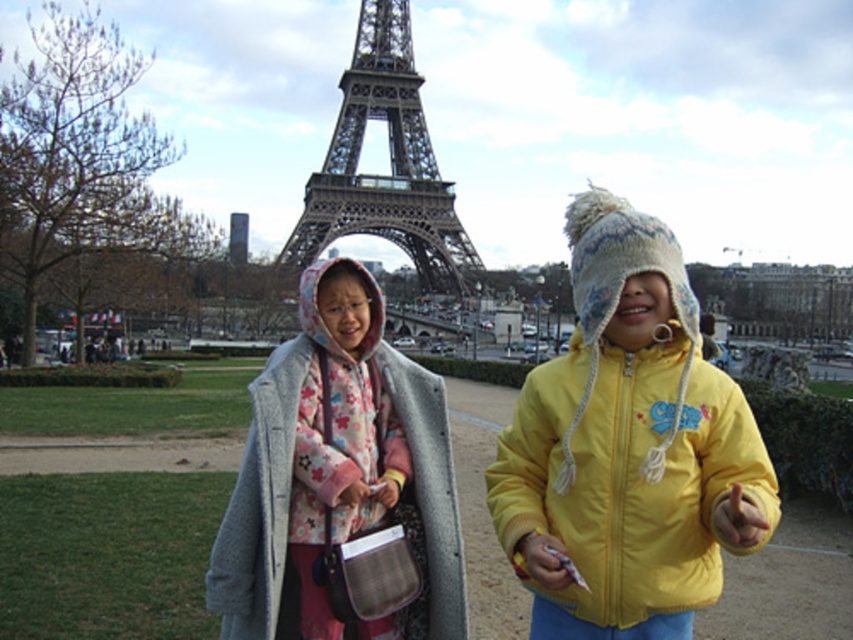
You are a photographer trying to capture the Eiffel Tower and the children in the frame. Based on the scene, can you determine if the yellow fleece jacket at center is blocking the view of the metallic structure at center?

The yellow fleece jacket at center is positioned under the metallic structure at center, so the jacket is below the structure and does not block its view.

In the scene shown: You are a photographer trying to capture a photo of the Eiffel Tower. There is a point at coordinates point (x=627, y=448) on the yellow fleece jacket at center. If you want to focus on the Eiffel Tower in the background, will this point be in focus?

The point (x=627, y=448) is on the yellow fleece jacket at center, which is in the foreground. Since the Eiffel Tower is in the background, focusing on the Eiffel Tower would mean the foreground objects like the yellow fleece jacket at center may not be in focus. Therefore, if you focus on the Eiffel Tower, the point on the yellow fleece jacket at center might not be in focus.